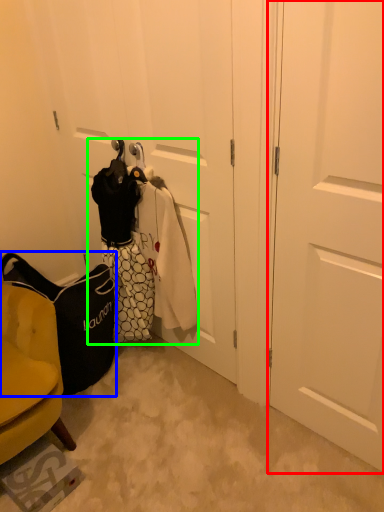
Question: Estimate the real-world distances between objects in this image. Which object is closer to door (highlighted by a red box), handbag (highlighted by a blue box) or laundry (highlighted by a green box)?

Choices:
 (A) handbag
 (B) laundry

Answer: (B)